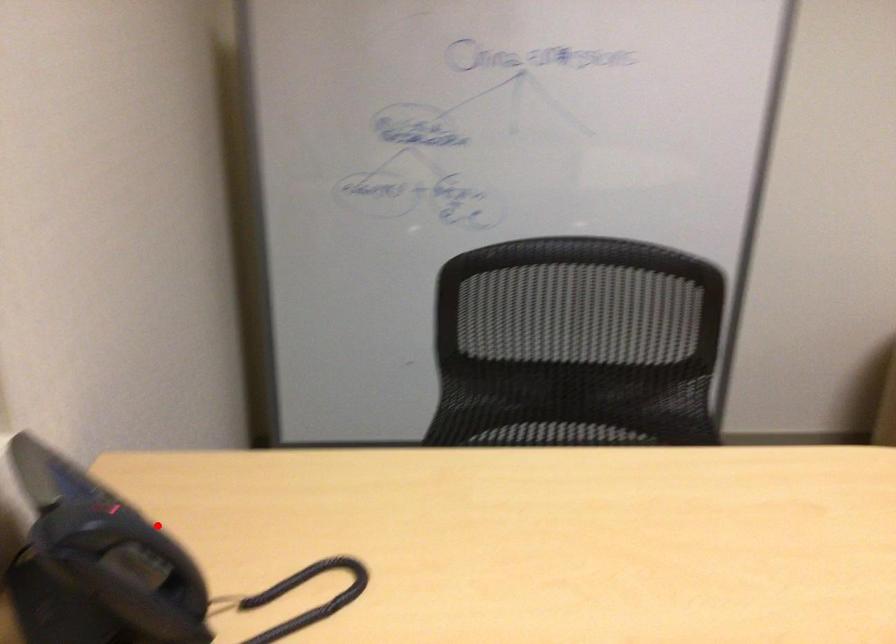
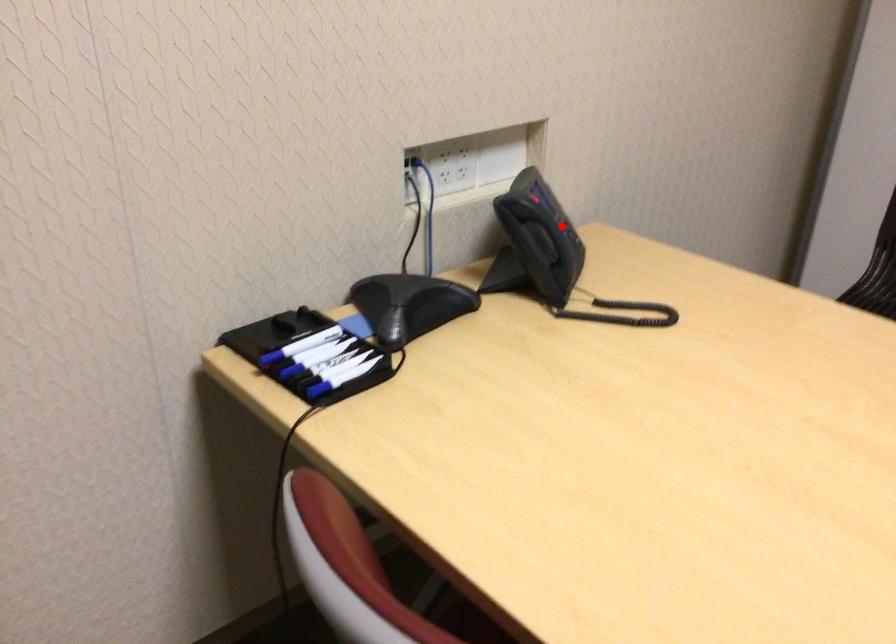
I am providing you with two images of the same scene from different viewpoints. A red point is marked on the first image and another point is marked on the second image. Is the red point in image1 aligned with the point shown in image2?

Yes